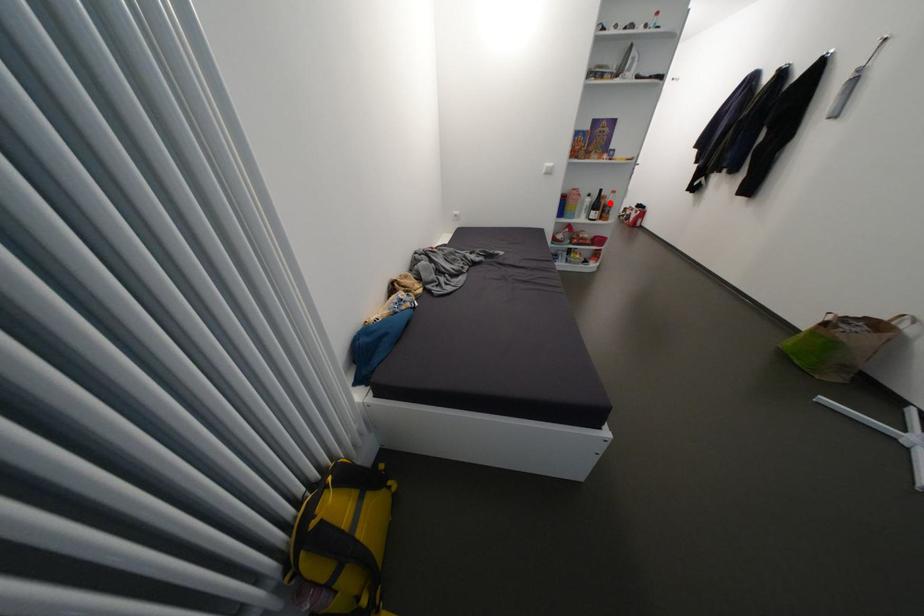
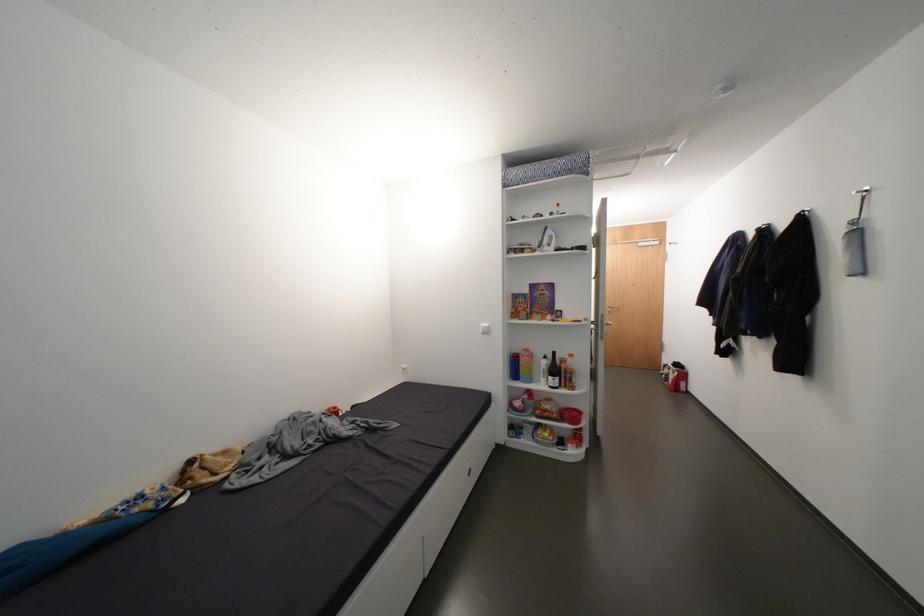
Question: I am providing you with two images of the same scene from different viewpoints. In image1, a red point is highlighted. Considering the same 3D point in image2, which of the following is correct?

Choices:
 (A) It is closer
 (B) It is farther

Answer: (B)